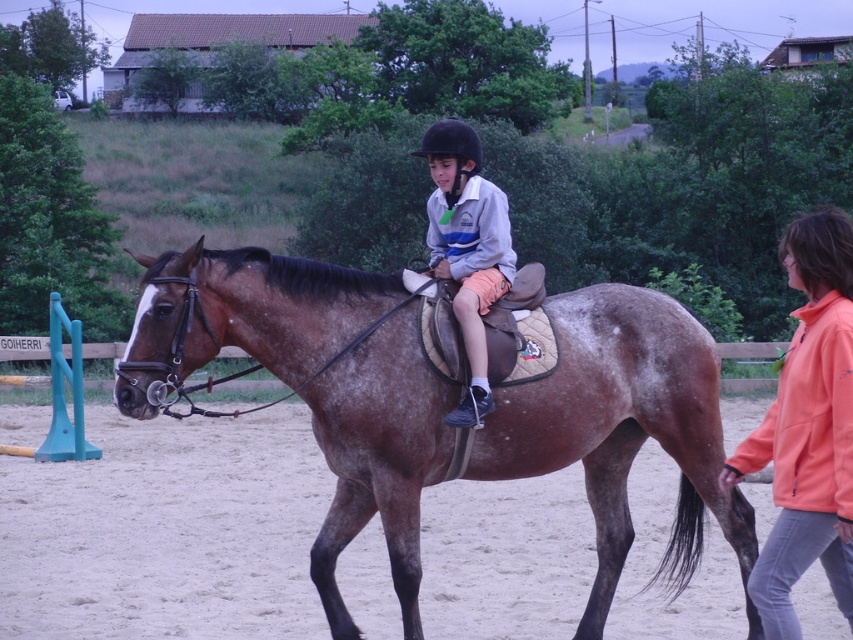
Question: Can you confirm if brown speckled saddle at center is positioned to the right of orange fleece jacket at right?

Choices:
 (A) yes
 (B) no

Answer: (B)

Question: Which object appears farthest from the camera in this image?

Choices:
 (A) orange fleece jacket at right
 (B) matte gray jacket at center

Answer: (B)

Question: Which object is positioned closest to the orange fleece jacket at right?

Choices:
 (A) brown speckled saddle at center
 (B) matte gray jacket at center

Answer: (A)

Question: Is the position of brown speckled saddle at center more distant than that of matte gray jacket at center?

Choices:
 (A) yes
 (B) no

Answer: (B)

Question: Which of the following is the farthest from the observer?

Choices:
 (A) orange fleece jacket at right
 (B) brown speckled saddle at center
 (C) matte gray jacket at center

Answer: (C)

Question: Can you confirm if brown speckled saddle at center is smaller than matte gray jacket at center?

Choices:
 (A) yes
 (B) no

Answer: (B)